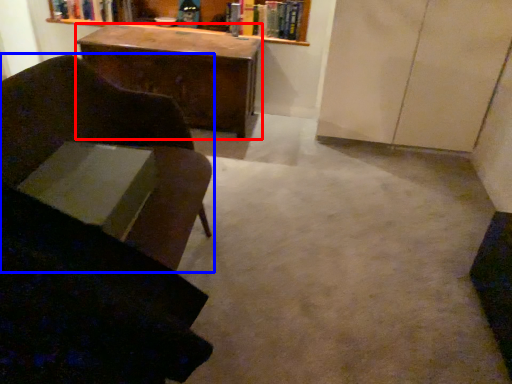
Question: Which object is further to the camera taking this photo, desk (highlighted by a red box) or chair (highlighted by a blue box)?

Choices:
 (A) desk
 (B) chair

Answer: (A)